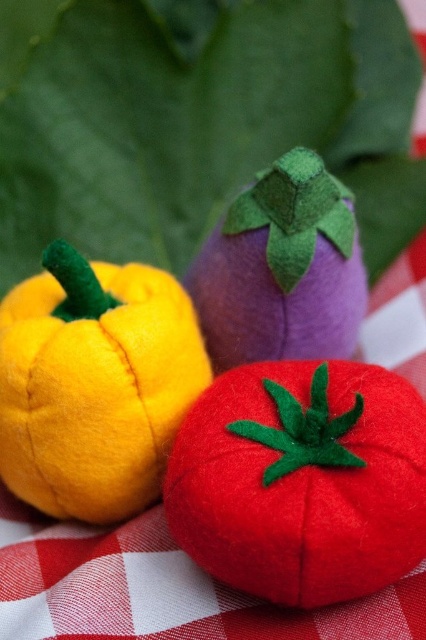
You are standing at the origin point of the coordinate system in the image. The origin is at the bottom left corner of the image. The x and y axes increase to the right and upwards respectively. You need to move to the location of the matte yellow felt pepper at left. What are the coordinates of the point where you need to go?

The coordinates of the matte yellow felt pepper at left are at point (94, 384).

You are looking at the three felted vegetables on the tablecloth. There are two points marked in the image. Which of the two points, point [135,333] or point [229,296], is closer to you?

Point [135,333] is closer to the camera than point [229,296].

You are setting up a display for a craft fair and need to arrange the matte yellow felt pepper at left and the purple felt eggplant at center on a shelf. If the shelf has limited space, which vegetable should you place first to ensure both fit properly?

The purple felt eggplant at center has a smaller width than the matte yellow felt pepper at left, so place the purple felt eggplant at center first to accommodate the larger pepper afterward.